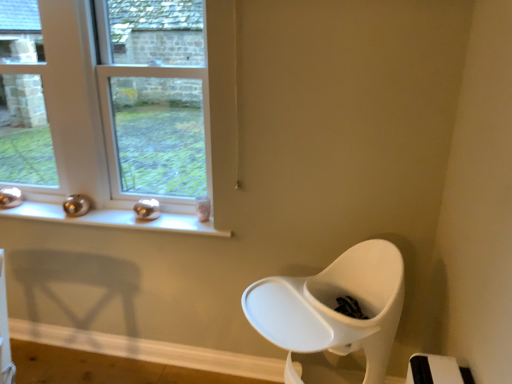
Locate an element on the screen. This screenshot has width=512, height=384. free space above metallic silver window sill at upper left (from a real-world perspective) is located at coordinates (93, 216).